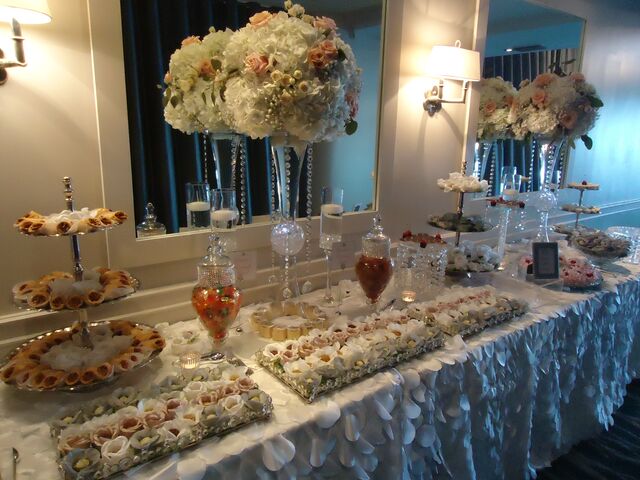
Identify the location of large flower bouquet. This screenshot has height=480, width=640. (289, 172), (550, 158).